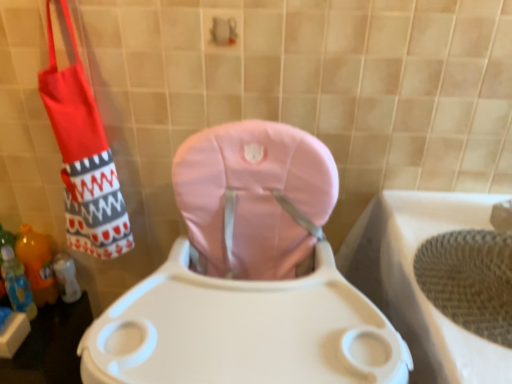
Question: Does red fabric shoulder bag at left appear on the left side of translucent orange bottle at lower left, the second bottle positioned from the front?

Choices:
 (A) no
 (B) yes

Answer: (A)

Question: Is red fabric shoulder bag at left directly adjacent to translucent orange bottle at lower left, which ranks as the 1th bottle in back-to-front order?

Choices:
 (A) yes
 (B) no

Answer: (B)

Question: Can you confirm if red fabric shoulder bag at left is bigger than translucent orange bottle at lower left, which ranks as the 1th bottle in back-to-front order?

Choices:
 (A) yes
 (B) no

Answer: (A)

Question: Could translucent orange bottle at lower left, the second bottle positioned from the front, be considered to be inside red fabric shoulder bag at left?

Choices:
 (A) no
 (B) yes

Answer: (A)

Question: Considering the relative sizes of red fabric shoulder bag at left and translucent orange bottle at lower left, which ranks as the 1th bottle in back-to-front order, in the image provided, is red fabric shoulder bag at left smaller than translucent orange bottle at lower left, which ranks as the 1th bottle in back-to-front order,?

Choices:
 (A) yes
 (B) no

Answer: (B)

Question: Considering the relative positions of red fabric shoulder bag at left and translucent orange bottle at lower left, the second bottle positioned from the front, in the image provided, is red fabric shoulder bag at left to the right of translucent orange bottle at lower left, the second bottle positioned from the front, from the viewer's perspective?

Choices:
 (A) no
 (B) yes

Answer: (B)

Question: Is woven beige bath at lower right located within translucent orange bottle at lower left, arranged as the second bottle when viewed from the back?

Choices:
 (A) no
 (B) yes

Answer: (A)

Question: Would you say translucent orange bottle at lower left, arranged as the second bottle when viewed from the back, is outside woven beige bath at lower right?

Choices:
 (A) no
 (B) yes

Answer: (B)

Question: From a real-world perspective, is translucent orange bottle at lower left, which appears as the 1th bottle when viewed from the front, over woven beige bath at lower right?

Choices:
 (A) yes
 (B) no

Answer: (B)

Question: Is translucent orange bottle at lower left, arranged as the second bottle when viewed from the back, further to camera compared to woven beige bath at lower right?

Choices:
 (A) yes
 (B) no

Answer: (A)

Question: Is translucent orange bottle at lower left, arranged as the second bottle when viewed from the back, touching woven beige bath at lower right?

Choices:
 (A) no
 (B) yes

Answer: (A)

Question: Does translucent orange bottle at lower left, which appears as the 1th bottle when viewed from the front, lie in front of woven beige bath at lower right?

Choices:
 (A) yes
 (B) no

Answer: (B)

Question: From a real-world perspective, is red fabric shoulder bag at left below pink fabric toilet at center?

Choices:
 (A) yes
 (B) no

Answer: (B)